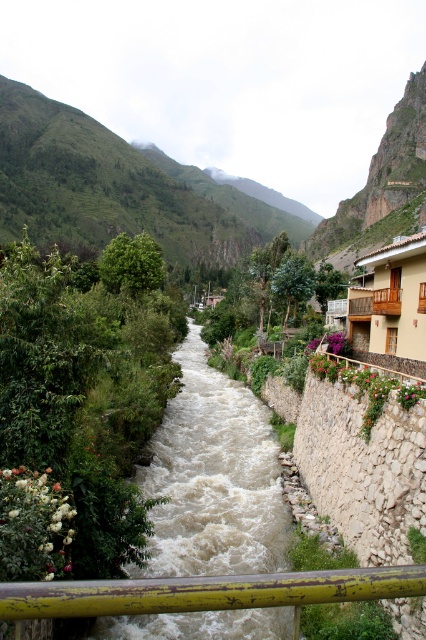
Is white frothy water at center to the right of yellow weathered rail at center from the viewer's perspective?

No, white frothy water at center is not to the right of yellow weathered rail at center.

Between white frothy water at center and yellow weathered rail at center, which one appears on the right side from the viewer's perspective?

From the viewer's perspective, yellow weathered rail at center appears more on the right side.

At what (x,y) coordinates should I click in order to perform the action: click on white frothy water at center. Please return your answer as a coordinate pair (x, y). The height and width of the screenshot is (640, 426). Looking at the image, I should click on (213, 477).

Which of these two, white frothy water at center or green grassy mountain at upper left, stands shorter?

With less height is white frothy water at center.

Which is behind, point (147, 547) or point (71, 132)?

Positioned behind is point (71, 132).

Where is `white frothy water at center`? The image size is (426, 640). white frothy water at center is located at coordinates (213, 477).

Does green grassy mountain at upper left come behind yellow weathered rail at center?

Yes.

Which is in front, point (141, 186) or point (77, 582)?

Point (77, 582)

Find the location of a particular element. The width and height of the screenshot is (426, 640). green grassy mountain at upper left is located at coordinates (118, 188).